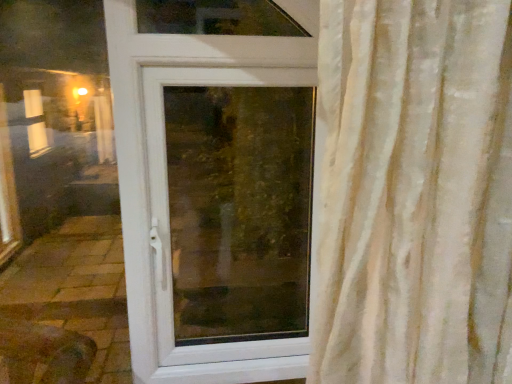
In order to face transparent glass window at center, should I rotate leftwards or rightwards?

Rotate your view left by about 2.726°.

What is the approximate width of transparent glass window at center?

Answer: transparent glass window at center is 3.50 inches wide.

Locate an element on the screen. Image resolution: width=512 pixels, height=384 pixels. transparent glass window at center is located at coordinates (239, 210).

Describe the element at coordinates (239, 210) in the screenshot. The width and height of the screenshot is (512, 384). I see `transparent glass window at center` at that location.

This screenshot has width=512, height=384. What do you see at coordinates (167, 183) in the screenshot?
I see `white plastic door at center` at bounding box center [167, 183].

The height and width of the screenshot is (384, 512). Identify the location of white plastic door at center. (167, 183).

In order to face white plastic door at center, should I rotate leftwards or rightwards?

Rotate your view left by about 13.232°.

At what (x,y) coordinates should I click in order to perform the action: click on transparent glass window at center. Please return your answer as a coordinate pair (x, y). This screenshot has width=512, height=384. Looking at the image, I should click on (239, 210).

Can you confirm if transparent glass window at center is positioned to the right of white plastic door at center?

Indeed, transparent glass window at center is positioned on the right side of white plastic door at center.

Is the position of transparent glass window at center more distant than that of white plastic door at center?

Yes, transparent glass window at center is behind white plastic door at center.

Does point (264, 332) lie in front of point (142, 55)?

No, (264, 332) is behind (142, 55).

From the image's perspective, is transparent glass window at center under white plastic door at center?

Correct, transparent glass window at center appears lower than white plastic door at center in the image.

From a real-world perspective, is transparent glass window at center positioned above or below white plastic door at center?

Clearly, from a real-world perspective, transparent glass window at center is below white plastic door at center.

Consider the image. Considering the relative sizes of transparent glass window at center and white plastic door at center in the image provided, is transparent glass window at center wider than white plastic door at center?

Indeed, transparent glass window at center has a greater width compared to white plastic door at center.

Can you confirm if transparent glass window at center is taller than white plastic door at center?

No.

Does transparent glass window at center have a smaller size compared to white plastic door at center?

Indeed, transparent glass window at center has a smaller size compared to white plastic door at center.

Would you say white plastic door at center is part of transparent glass window at center's contents?

Yes, white plastic door at center is surrounded by transparent glass window at center.

Is transparent glass window at center far away from white plastic door at center?

No, transparent glass window at center is in close proximity to white plastic door at center.

Could you tell me if transparent glass window at center is facing white plastic door at center?

Yes.

In order to click on door that is above the transparent glass window at center (from the image's perspective) in this screenshot , I will do `click(167, 183)`.

Considering the relative positions of white plastic door at center and transparent glass window at center in the image provided, is white plastic door at center to the left or to the right of transparent glass window at center?

Based on their positions, white plastic door at center is located to the left of transparent glass window at center.

Based on the photo, considering the relative positions of white plastic door at center and transparent glass window at center in the image provided, is white plastic door at center in front of transparent glass window at center?

Yes, it is in front of transparent glass window at center.

Considering the positions of points (213, 348) and (298, 109), is point (213, 348) farther from camera compared to point (298, 109)?

No.

Consider the image. From the image's perspective, which object appears higher, white plastic door at center or transparent glass window at center?

white plastic door at center.

From a real-world perspective, is white plastic door at center above or below transparent glass window at center?

In terms of real-world spatial position, white plastic door at center is above transparent glass window at center.

Can you confirm if white plastic door at center is wider than transparent glass window at center?

Incorrect, the width of white plastic door at center does not surpass that of transparent glass window at center.

Is white plastic door at center shorter than transparent glass window at center?

No, white plastic door at center is not shorter than transparent glass window at center.

Is white plastic door at center smaller than transparent glass window at center?

No, white plastic door at center is not smaller than transparent glass window at center.

Is white plastic door at center surrounding transparent glass window at center?

Yes, transparent glass window at center is a part of white plastic door at center.

Are white plastic door at center and transparent glass window at center making contact?

No, white plastic door at center is not beside transparent glass window at center.

Is white plastic door at center looking in the opposite direction of transparent glass window at center?

That's right, white plastic door at center is facing away from transparent glass window at center.

How far apart are white plastic door at center and transparent glass window at center?

white plastic door at center and transparent glass window at center are 11.80 inches apart.

Where is `window screen directly beneath the white plastic door at center (from a real-world perspective)`? window screen directly beneath the white plastic door at center (from a real-world perspective) is located at coordinates (239, 210).

The width and height of the screenshot is (512, 384). Identify the location of door lying in front of the transparent glass window at center. (167, 183).

Find the location of a particular element. door on the left side of transparent glass window at center is located at coordinates (167, 183).